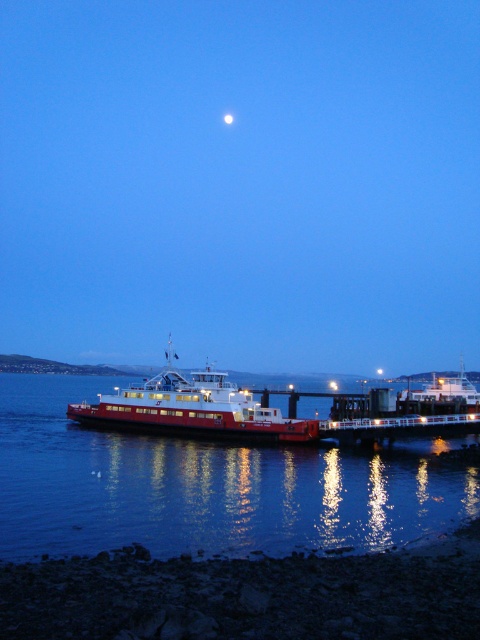
Question: Which object is closer to the camera taking this photo?

Choices:
 (A) glossy water at lower left
 (B) red matte ferry at center
 (C) smooth sand shoreline at lower left

Answer: (C)

Question: Is glossy water at lower left to the left of smooth sand shoreline at lower left from the viewer's perspective?

Choices:
 (A) yes
 (B) no

Answer: (A)

Question: Is glossy water at lower left below smooth sand shoreline at lower left?

Choices:
 (A) yes
 (B) no

Answer: (A)

Question: Which of these objects is positioned farthest from the smooth sand shoreline at lower left?

Choices:
 (A) glossy water at lower left
 (B) red matte ferry at center

Answer: (B)

Question: Where is glossy water at lower left located in relation to smooth sand shoreline at lower left in the image?

Choices:
 (A) right
 (B) left

Answer: (B)

Question: Which of the following is the farthest from the observer?

Choices:
 (A) glossy water at lower left
 (B) red matte ferry at center

Answer: (B)